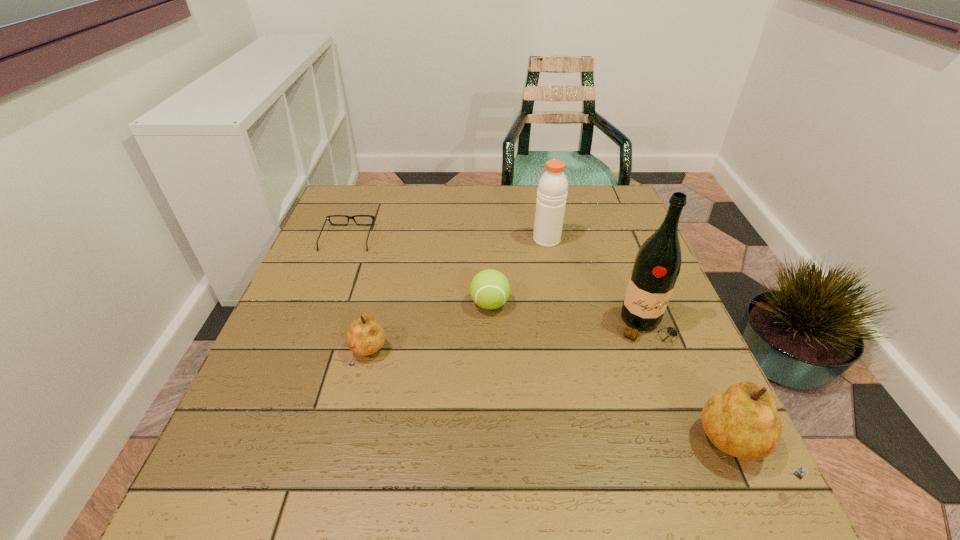
Locate an element on the screen. object that is the second closest to the wine bottle is located at coordinates (552, 189).

What are the coordinates of `object identified as the fifth closest to the tennis ball` in the screenshot? It's located at [x=742, y=421].

At what (x,y) coordinates should I click in order to perform the action: click on free location that satisfies the following two spatial constraints: 1. on the front side of the third object from left to right; 2. on the right side of the third tallest object. Please return your answer as a coordinate pair (x, y). The height and width of the screenshot is (540, 960). Looking at the image, I should click on (493, 450).

You are a GUI agent. You are given a task and a screenshot of the screen. Output one action in this format:
    pyautogui.click(x=<x>, y=<y>)
    Task: Click on the vacant region that satisfies the following two spatial constraints: 1. on the surface of the nearest object; 2. on the left side of the wine bottle
    
    Given the screenshot: What is the action you would take?
    pyautogui.click(x=692, y=450)

This screenshot has height=540, width=960. Find the location of `free space that satisfies the following two spatial constraints: 1. on the surface of the tallest object; 2. on the right side of the taller pear`. free space that satisfies the following two spatial constraints: 1. on the surface of the tallest object; 2. on the right side of the taller pear is located at coordinates (692, 450).

Identify the location of vacant area that satisfies the following two spatial constraints: 1. on the back side of the shaker; 2. on the left side of the tennis ball. The image size is (960, 540). (489, 240).